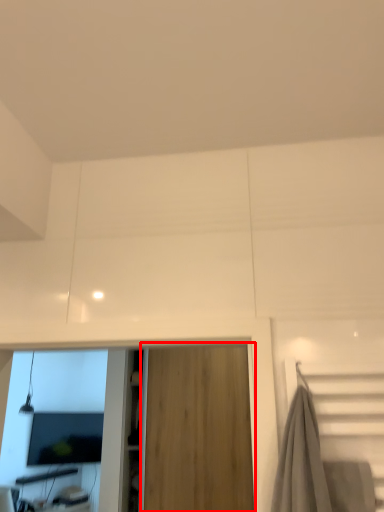
Question: Where is garage door (annotated by the red box) located in relation to computer monitor in the image?

Choices:
 (A) right
 (B) left

Answer: (A)